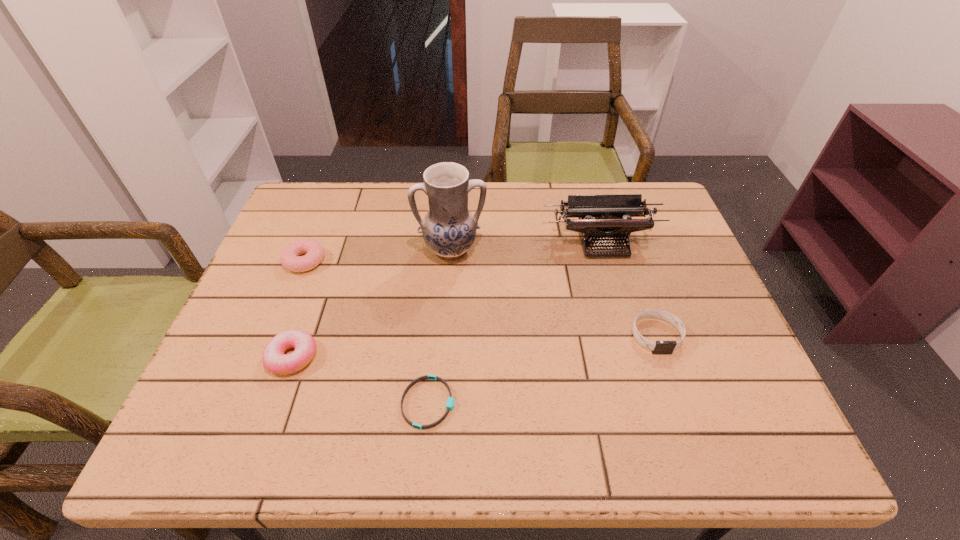
Locate an element on the screen. This screenshot has width=960, height=540. the tallest object is located at coordinates (449, 229).

The height and width of the screenshot is (540, 960). Find the location of `the second tallest object`. the second tallest object is located at coordinates (613, 214).

The height and width of the screenshot is (540, 960). Find the location of `the farther doughnut`. the farther doughnut is located at coordinates (289, 257).

You are a GUI agent. You are given a task and a screenshot of the screen. Output one action in this format:
    pyautogui.click(x=<x>, y=<y>)
    Task: Click on the farther wristband
    The width and height of the screenshot is (960, 540).
    Given the screenshot: What is the action you would take?
    pyautogui.click(x=659, y=347)

What are the coordinates of `the right wristband` in the screenshot? It's located at (659, 347).

This screenshot has width=960, height=540. I want to click on the nearer doughnut, so click(274, 359).

Find the location of a particular element. the nearer wristband is located at coordinates (450, 404).

Image resolution: width=960 pixels, height=540 pixels. I want to click on the shorter wristband, so click(x=450, y=404).

Locate an element on the screen. The width and height of the screenshot is (960, 540). blank space located on the left of the tallest object is located at coordinates (379, 250).

Where is `free space located on the typing side of the typewriter`? This screenshot has height=540, width=960. free space located on the typing side of the typewriter is located at coordinates (617, 293).